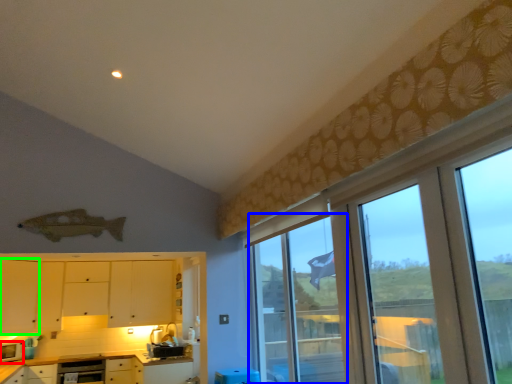
Question: Which object is positioned farthest from appliance (highlighted by a red box)? Select from window (highlighted by a blue box) and cabinetry (highlighted by a green box).

Choices:
 (A) window
 (B) cabinetry

Answer: (A)